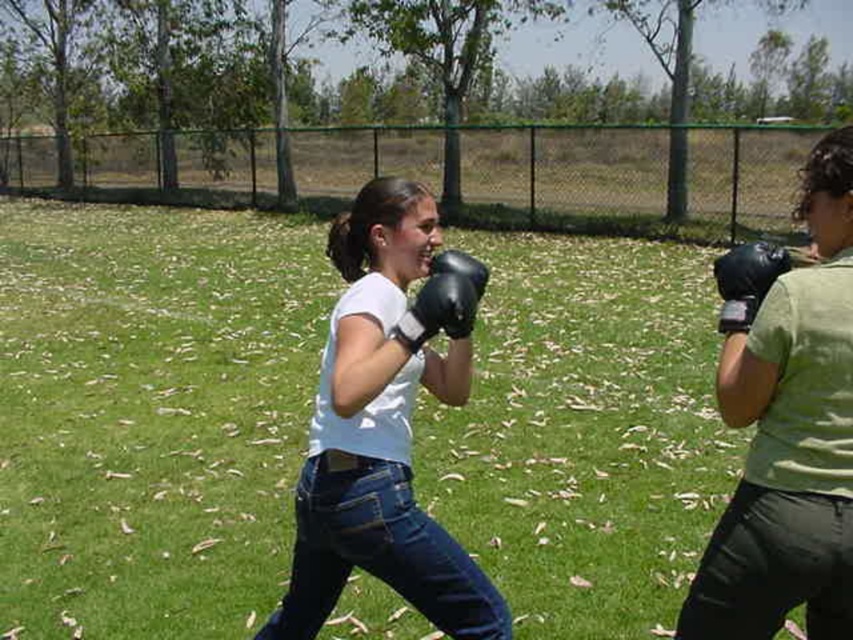
Question: Can you confirm if green grass at center is wider than black synthetic glove at right?

Choices:
 (A) no
 (B) yes

Answer: (B)

Question: Which point is closer to the camera?

Choices:
 (A) (412, 301)
 (B) (27, 397)
 (C) (784, 262)
 (D) (405, 490)

Answer: (C)

Question: Which object appears closest to the camera in this image?

Choices:
 (A) green grass at center
 (B) black leather boxing glove at center
 (C) black synthetic glove at right
 (D) matte black boxing glove at right

Answer: (D)

Question: Does black leather boxing glove at center have a greater width compared to black synthetic glove at right?

Choices:
 (A) yes
 (B) no

Answer: (A)

Question: Can you confirm if matte black boxing glove at right is positioned above black leather boxing glove at center?

Choices:
 (A) no
 (B) yes

Answer: (A)

Question: Which object appears closest to the camera in this image?

Choices:
 (A) black leather boxing glove at center
 (B) white matte t-shirt at center
 (C) matte black boxing glove at right

Answer: (C)